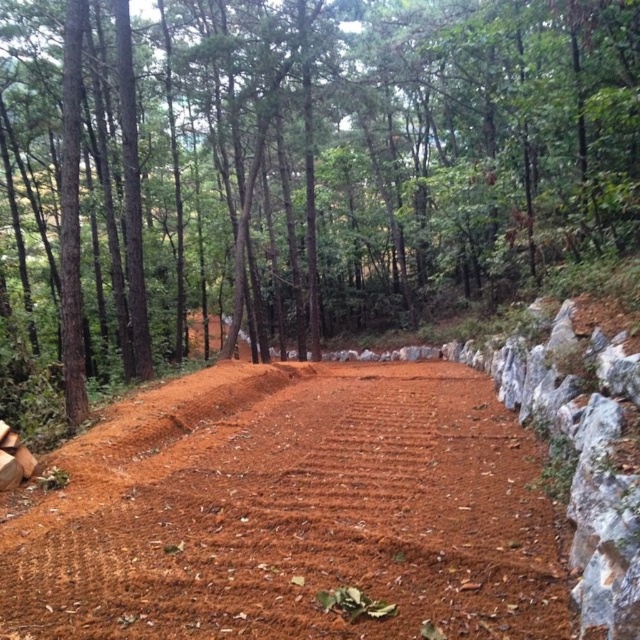
Question: Which point appears farthest from the camera in this image?

Choices:
 (A) (445, 49)
 (B) (344, 524)

Answer: (A)

Question: Is brown dirt road at center wider than brown textured dirt track at center?

Choices:
 (A) yes
 (B) no

Answer: (A)

Question: Is the position of brown dirt road at center less distant than that of brown textured dirt track at center?

Choices:
 (A) yes
 (B) no

Answer: (B)

Question: Which point is farther to the camera?

Choices:
 (A) (548, 68)
 (B) (419, 516)

Answer: (A)

Question: Does brown dirt road at center lie in front of brown textured dirt track at center?

Choices:
 (A) yes
 (B) no

Answer: (B)